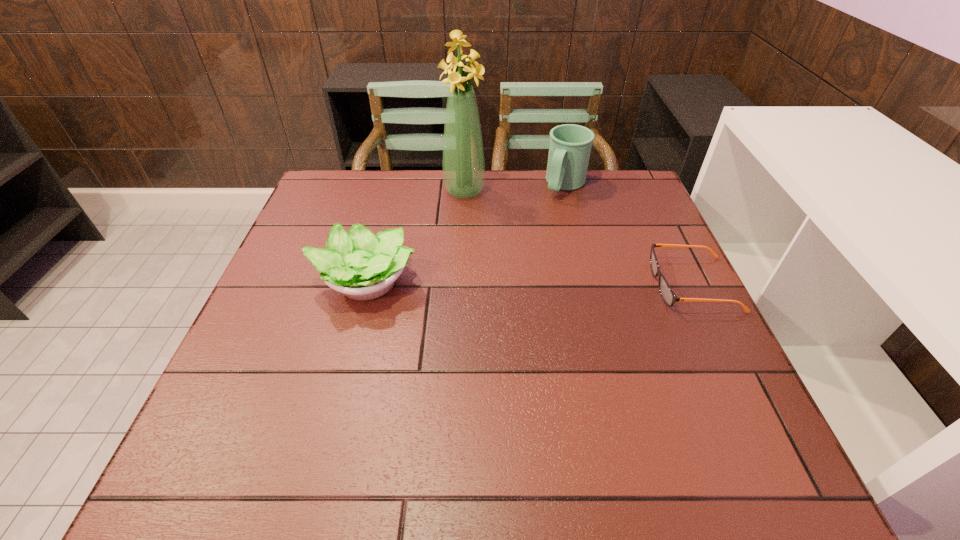
Locate an element on the screen. Image resolution: width=960 pixels, height=540 pixels. blank area located on the front-facing side of the spectacles is located at coordinates (517, 285).

Image resolution: width=960 pixels, height=540 pixels. Find the location of `vacant space situated 0.110m on the front-facing side of the spectacles`. vacant space situated 0.110m on the front-facing side of the spectacles is located at coordinates (607, 285).

The image size is (960, 540). I want to click on free location located 0.050m on the side of the third shortest object with the handle, so click(552, 209).

The image size is (960, 540). Identify the location of vacant space situated on the side of the third shortest object with the handle. (531, 240).

Identify the location of vacant space located on the side of the third shortest object with the handle. (542, 224).

Find the location of a particular element. The width and height of the screenshot is (960, 540). vacant space located on the front-facing side of the bouquet is located at coordinates (499, 258).

This screenshot has width=960, height=540. Find the location of `free space located on the front-facing side of the bouquet`. free space located on the front-facing side of the bouquet is located at coordinates (502, 263).

Find the location of a particular element. Image resolution: width=960 pixels, height=540 pixels. free space located on the front-facing side of the bouquet is located at coordinates (477, 215).

Find the location of a particular element. The height and width of the screenshot is (540, 960). mug at the far edge is located at coordinates (570, 146).

This screenshot has width=960, height=540. I want to click on bouquet at the far edge, so click(x=463, y=163).